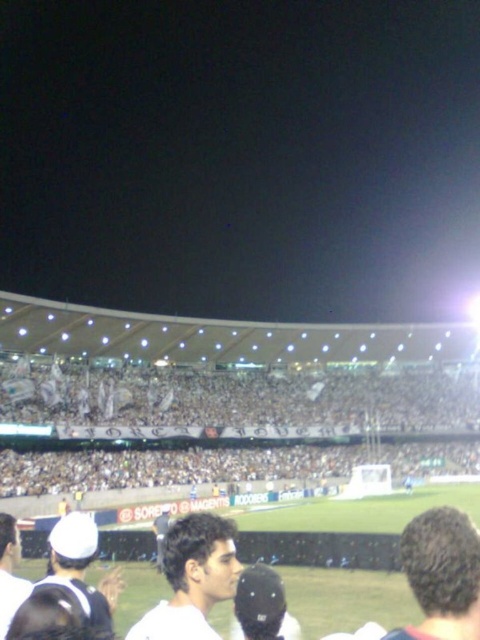
Question: Can you confirm if dark brown hair at lower right is positioned below white matte cap at center?

Choices:
 (A) yes
 (B) no

Answer: (A)

Question: Which of these objects is positioned farthest from the dark brown hair at lower right?

Choices:
 (A) white fabric banner at center
 (B) white matte shirt at center
 (C) white matte cap at center
 (D) white matte cap at lower left

Answer: (A)

Question: Considering the real-world distances, which object is closest to the white fabric banner at center?

Choices:
 (A) dark brown hair at lower right
 (B) white matte cap at lower left
 (C) white matte cap at center

Answer: (B)

Question: Among these objects, which one is nearest to the camera?

Choices:
 (A) white matte cap at lower left
 (B) white matte shirt at center

Answer: (A)

Question: Where is dark brown hair at lower right located in relation to white matte cap at center in the image?

Choices:
 (A) left
 (B) right

Answer: (B)

Question: Where is dark brown hair at lower right located in relation to white matte cap at lower left in the image?

Choices:
 (A) right
 (B) left

Answer: (A)